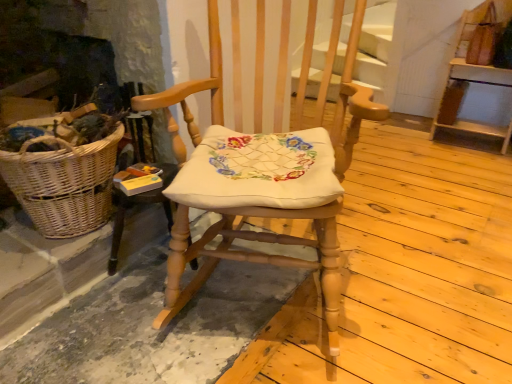
The height and width of the screenshot is (384, 512). Find the location of `spots to the right of wooden rocking chair at center`. spots to the right of wooden rocking chair at center is located at coordinates (420, 273).